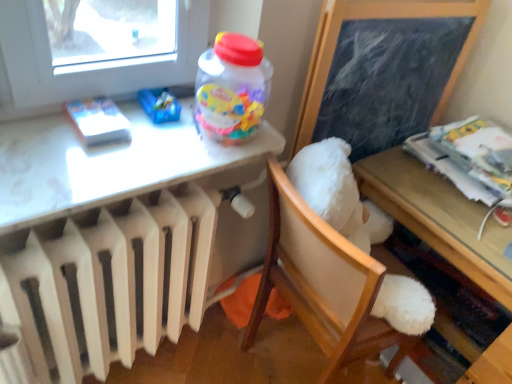
Question: Choose the correct answer: Is wooden table at lower right, which appears as the 2th table when viewed from the left, inside printed paper stack at right, which ranks as the 1th magazine in back-to-front order, or outside it?

Choices:
 (A) inside
 (B) outside

Answer: (B)

Question: Visually, is wooden table at lower right, which appears as the 2th table when viewed from the left, positioned to the left or to the right of printed paper stack at right, placed as the second magazine when sorted from left to right?

Choices:
 (A) right
 (B) left

Answer: (B)

Question: Which object is the closest to the printed paper stack at right, which ranks as the first magazine in right-to-left order?

Choices:
 (A) white plush chair at center
 (B) white matte book at upper left, marked as the first magazine in a front-to-back arrangement
 (C) wooden table at lower right, the 1th table viewed from the right
 (D) black chalkboard at upper right
 (E) white glossy table at upper left, which appears as the 2th table when viewed from the right

Answer: (C)

Question: Which is farther from the black chalkboard at upper right?

Choices:
 (A) white plush chair at center
 (B) white plastic radiator at lower left
 (C) white matte book at upper left, marked as the first magazine in a front-to-back arrangement
 (D) white glossy table at upper left, which ranks as the first table in left-to-right order
 (E) printed paper stack at right, which ranks as the 1th magazine in back-to-front order

Answer: (C)